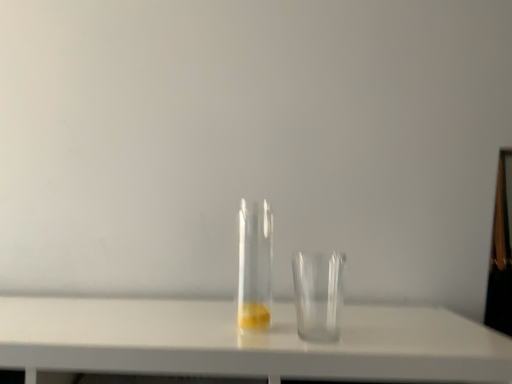
Question: Considering their positions, is transparent glass cup at center located in front of or behind transparent glass tube at center?

Choices:
 (A) behind
 (B) front

Answer: (B)

Question: Considering the positions of transparent glass cup at center and transparent glass tube at center in the image, is transparent glass cup at center wider or thinner than transparent glass tube at center?

Choices:
 (A) thin
 (B) wide

Answer: (B)

Question: Does point click(x=328, y=269) appear closer or farther from the camera than point click(x=262, y=205)?

Choices:
 (A) closer
 (B) farther

Answer: (B)

Question: From the image's perspective, is transparent glass tube at center above or below transparent glass cup at center?

Choices:
 (A) above
 (B) below

Answer: (A)

Question: Looking at their shapes, would you say transparent glass tube at center is wider or thinner than transparent glass cup at center?

Choices:
 (A) wide
 (B) thin

Answer: (B)

Question: Is point (243, 291) positioned closer to the camera than point (295, 289)?

Choices:
 (A) farther
 (B) closer

Answer: (B)

Question: Considering their positions, is transparent glass tube at center located in front of or behind transparent glass cup at center?

Choices:
 (A) behind
 (B) front

Answer: (A)